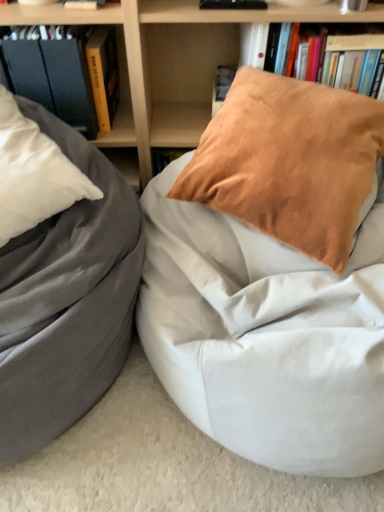
Question: Does matte black book at upper left, acting as the 1th book starting from the left, appear on the right side of matte black bookshelf at upper left?

Choices:
 (A) yes
 (B) no

Answer: (B)

Question: Does matte black book at upper left, placed as the third book when sorted from right to left, have a greater height compared to matte black bookshelf at upper left?

Choices:
 (A) no
 (B) yes

Answer: (A)

Question: Can you confirm if matte black book at upper left, placed as the third book when sorted from right to left, is shorter than matte black bookshelf at upper left?

Choices:
 (A) yes
 (B) no

Answer: (A)

Question: Is matte black book at upper left, placed as the third book when sorted from right to left, to the left of matte black bookshelf at upper left from the viewer's perspective?

Choices:
 (A) yes
 (B) no

Answer: (A)

Question: From a real-world perspective, is matte black book at upper left, placed as the third book when sorted from right to left, under matte black bookshelf at upper left?

Choices:
 (A) yes
 (B) no

Answer: (A)

Question: Does matte black book at upper left, placed as the third book when sorted from right to left, lie behind matte black bookshelf at upper left?

Choices:
 (A) yes
 (B) no

Answer: (A)

Question: From the image's perspective, is hardcover book at left located above wooden bookshelf at upper center?

Choices:
 (A) yes
 (B) no

Answer: (A)

Question: From a real-world perspective, is hardcover book at left physically below wooden bookshelf at upper center?

Choices:
 (A) yes
 (B) no

Answer: (B)

Question: Is hardcover book at left further to the viewer compared to wooden bookshelf at upper center?

Choices:
 (A) yes
 (B) no

Answer: (A)

Question: Is hardcover book at left taller than wooden bookshelf at upper center?

Choices:
 (A) no
 (B) yes

Answer: (A)

Question: Would you say wooden bookshelf at upper center is part of hardcover book at left's contents?

Choices:
 (A) no
 (B) yes

Answer: (A)

Question: Considering the relative sizes of hardcover book at left and wooden bookshelf at upper center in the image provided, is hardcover book at left shorter than wooden bookshelf at upper center?

Choices:
 (A) no
 (B) yes

Answer: (B)

Question: Is hardcover book at upper center, which ranks as the 3th book in left-to-right order, oriented towards white fabric bean bag at center?

Choices:
 (A) no
 (B) yes

Answer: (B)